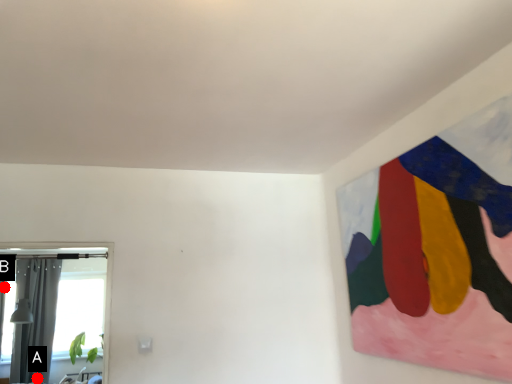
Question: Two points are circled on the image, labeled by A and B beside each circle. Which point is closer to the camera taking this photo?

Choices:
 (A) A is closer
 (B) B is closer

Answer: (B)